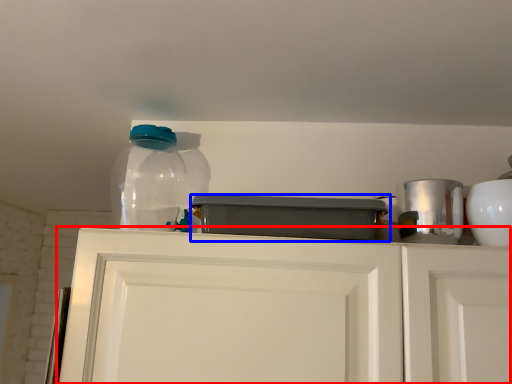
Question: Among these objects, which one is farthest to the camera, cabinetry (highlighted by a red box) or appliance (highlighted by a blue box)?

Choices:
 (A) cabinetry
 (B) appliance

Answer: (B)